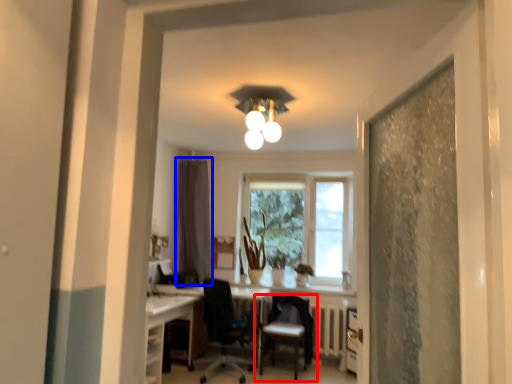
Question: Which object is closer to the camera taking this photo, chair (highlighted by a red box) or curtain (highlighted by a blue box)?

Choices:
 (A) chair
 (B) curtain

Answer: (A)